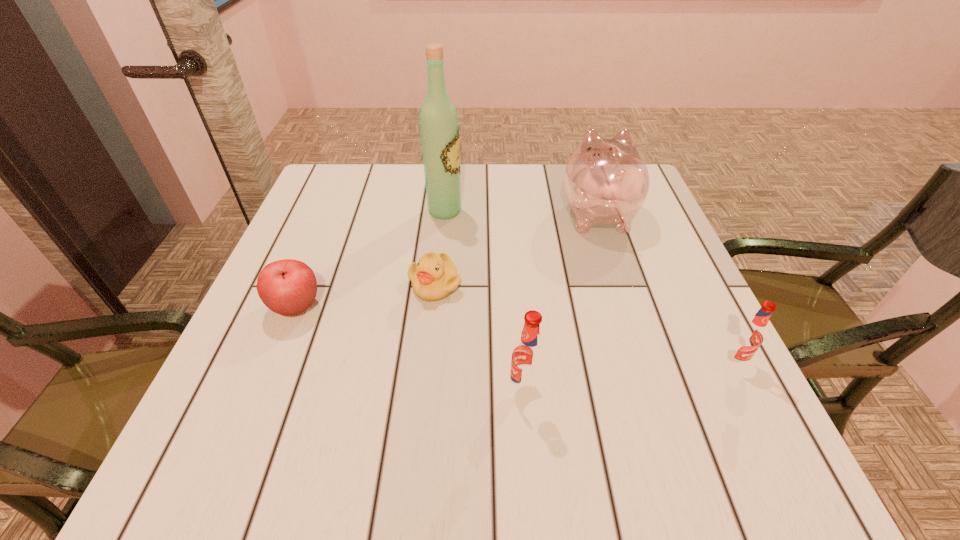
At what (x,y) coordinates should I click in order to perform the action: click on object that stands as the third closest to the piggy bank. Please return your answer as a coordinate pair (x, y). Looking at the image, I should click on (x=749, y=336).

Identify the location of free location that satisfies the following two spatial constraints: 1. on the front-facing side of the fourth tallest object; 2. on the right side of the wine bottle. The width and height of the screenshot is (960, 540). (430, 361).

Find the location of a particular element. blank space that satisfies the following two spatial constraints: 1. on the front-facing side of the nearer root beer; 2. on the right side of the duckling is located at coordinates (424, 389).

Identify the location of blank space that satisfies the following two spatial constraints: 1. on the front-facing side of the wine bottle; 2. on the front-facing side of the shortest object. (438, 284).